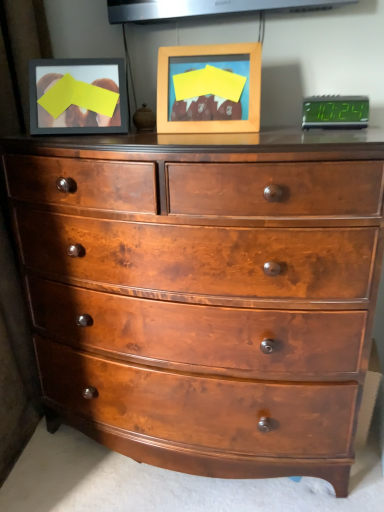
What is the approximate height of green digital display at upper right?

green digital display at upper right is 4.70 inches tall.

I want to click on wooden picture frame at center, so click(209, 89).

The height and width of the screenshot is (512, 384). I want to click on green digital display at upper right, so click(335, 112).

Considering the relative sizes of wooden picture frame at center and green digital display at upper right in the image provided, is wooden picture frame at center taller than green digital display at upper right?

Yes.

From the picture: From the image's perspective, relative to green digital display at upper right, is wooden picture frame at center above or below?

Clearly, from the image's perspective, wooden picture frame at center is above green digital display at upper right.

Is wooden picture frame at center aimed at green digital display at upper right?

No, wooden picture frame at center is not oriented towards green digital display at upper right.

From the picture: Is the depth of wooden picture frame at center less than that of green digital display at upper right?

Yes, it is in front of green digital display at upper right.

Does shiny brown wood chest of drawers at center appear on the left side of wooden picture frame at center?

Correct, you'll find shiny brown wood chest of drawers at center to the left of wooden picture frame at center.

Does shiny brown wood chest of drawers at center have a larger size compared to wooden picture frame at center?

Correct, shiny brown wood chest of drawers at center is larger in size than wooden picture frame at center.

What's the angular difference between shiny brown wood chest of drawers at center and wooden picture frame at center's facing directions?

The angle between the facing direction of shiny brown wood chest of drawers at center and the facing direction of wooden picture frame at center is 10.5 degrees.

Who is shorter, shiny brown wood chest of drawers at center or wooden picture frame at center?

wooden picture frame at center is shorter.

From the image's perspective, is green digital display at upper right on wooden picture frame at center?

No.

Considering the sizes of green digital display at upper right and wooden picture frame at center in the image, is green digital display at upper right bigger or smaller than wooden picture frame at center?

In the image, green digital display at upper right appears to be smaller than wooden picture frame at center.

How many degrees apart are the facing directions of green digital display at upper right and wooden picture frame at center?

4.47 degrees separate the facing orientations of green digital display at upper right and wooden picture frame at center.

Considering the sizes of green digital display at upper right and wooden picture frame at center in the image, is green digital display at upper right taller or shorter than wooden picture frame at center?

Clearly, green digital display at upper right is shorter compared to wooden picture frame at center.

From a real-world perspective, is green digital display at upper right below shiny brown wood chest of drawers at center?

No, from a real-world perspective, green digital display at upper right is not under shiny brown wood chest of drawers at center.

Could you tell me if green digital display at upper right is turned towards shiny brown wood chest of drawers at center?

No, green digital display at upper right does not turn towards shiny brown wood chest of drawers at center.

Is green digital display at upper right at the right side of shiny brown wood chest of drawers at center?

Yes, green digital display at upper right is to the right of shiny brown wood chest of drawers at center.

Which object is positioned more to the right, shiny brown wood chest of drawers at center or green digital display at upper right?

Positioned to the right is green digital display at upper right.

How distant is shiny brown wood chest of drawers at center from green digital display at upper right?

shiny brown wood chest of drawers at center and green digital display at upper right are 27.23 inches apart from each other.

Which of these two, shiny brown wood chest of drawers at center or green digital display at upper right, is bigger?

shiny brown wood chest of drawers at center is bigger.

In the scene shown: Which is in front, shiny brown wood chest of drawers at center or green digital display at upper right?

shiny brown wood chest of drawers at center is closer to the camera.

Visually, is wooden picture frame at center positioned to the left or to the right of shiny brown wood chest of drawers at center?

From the image, it's evident that wooden picture frame at center is to the right of shiny brown wood chest of drawers at center.

From a real-world perspective, which object stands above the other?

wooden picture frame at center, from a real-world perspective.

Is wooden picture frame at center not close to shiny brown wood chest of drawers at center?

Actually, wooden picture frame at center and shiny brown wood chest of drawers at center are a little close together.

Which is less distant, (247, 83) or (39, 215)?

Point (247, 83) is closer to the camera than point (39, 215).

Where is `picture frame located above the green digital display at upper right (from the image's perspective)`? picture frame located above the green digital display at upper right (from the image's perspective) is located at coordinates (209, 89).

Find the location of `the chest of drawers that is in front of the wooden picture frame at center`. the chest of drawers that is in front of the wooden picture frame at center is located at coordinates (204, 292).

When comparing their distances from shiny brown wood chest of drawers at center, does wooden picture frame at center or green digital display at upper right seem closer?

wooden picture frame at center lies closer to shiny brown wood chest of drawers at center than the other object.

Estimate the real-world distances between objects in this image. Which object is further from wooden picture frame at center, shiny brown wood chest of drawers at center or green digital display at upper right?

The object further to wooden picture frame at center is shiny brown wood chest of drawers at center.

Estimate the real-world distances between objects in this image. Which object is closer to green digital display at upper right, wooden picture frame at center or shiny brown wood chest of drawers at center?

wooden picture frame at center is closer to green digital display at upper right.

Estimate the real-world distances between objects in this image. Which object is further from wooden picture frame at center, green digital display at upper right or shiny brown wood chest of drawers at center?

shiny brown wood chest of drawers at center lies further to wooden picture frame at center than the other object.

Looking at the image, which one is located further to shiny brown wood chest of drawers at center, green digital display at upper right or wooden picture frame at center?

Based on the image, green digital display at upper right appears to be further to shiny brown wood chest of drawers at center.

Consider the image. When comparing their distances from green digital display at upper right, does shiny brown wood chest of drawers at center or wooden picture frame at center seem further?

Based on the image, shiny brown wood chest of drawers at center appears to be further to green digital display at upper right.

At what (x,y) coordinates should I click in order to perform the action: click on alarm clock between wooden picture frame at center and shiny brown wood chest of drawers at center vertically. Please return your answer as a coordinate pair (x, y). Image resolution: width=384 pixels, height=512 pixels. Looking at the image, I should click on (335, 112).